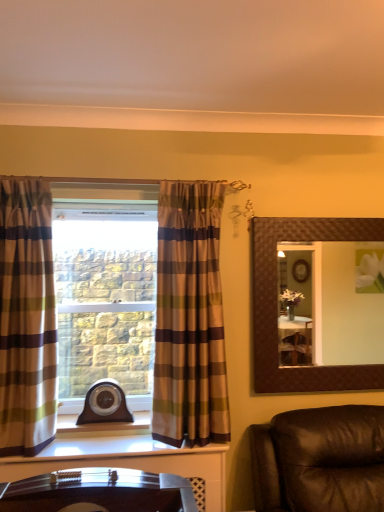
Question: Is brown textured mirror at upper right outside of plaid fabric curtain at left, the 2th curtain positioned from the right?

Choices:
 (A) yes
 (B) no

Answer: (A)

Question: Does brown textured mirror at upper right lie in front of plaid fabric curtain at left, the 2th curtain positioned from the right?

Choices:
 (A) no
 (B) yes

Answer: (A)

Question: Is brown textured mirror at upper right beside plaid fabric curtain at left, the first curtain from the left?

Choices:
 (A) yes
 (B) no

Answer: (B)

Question: Does brown textured mirror at upper right have a greater height compared to plaid fabric curtain at left, the first curtain from the left?

Choices:
 (A) no
 (B) yes

Answer: (A)

Question: Does brown textured mirror at upper right appear on the left side of plaid fabric curtain at left, the 2th curtain positioned from the right?

Choices:
 (A) no
 (B) yes

Answer: (A)

Question: Are brown textured mirror at upper right and plaid fabric curtain at left, the first curtain from the left, far apart?

Choices:
 (A) no
 (B) yes

Answer: (B)

Question: Is brown textured mirror at upper right a part of plaid fabric curtain at left, the 2th curtain positioned from the right?

Choices:
 (A) no
 (B) yes

Answer: (A)

Question: From the image's perspective, would you say plaid fabric curtain at left, the first curtain from the left, is shown under brown textured mirror at upper right?

Choices:
 (A) yes
 (B) no

Answer: (B)

Question: Does plaid fabric curtain at left, the 2th curtain positioned from the right, have a lesser height compared to brown textured mirror at upper right?

Choices:
 (A) yes
 (B) no

Answer: (B)

Question: Is plaid fabric curtain at left, the 2th curtain positioned from the right, wider than brown textured mirror at upper right?

Choices:
 (A) yes
 (B) no

Answer: (A)

Question: From a real-world perspective, is plaid fabric curtain at left, the first curtain from the left, located higher than brown textured mirror at upper right?

Choices:
 (A) yes
 (B) no

Answer: (A)

Question: Considering the relative positions of plaid fabric curtain at left, the 2th curtain positioned from the right, and brown textured mirror at upper right in the image provided, is plaid fabric curtain at left, the 2th curtain positioned from the right, behind brown textured mirror at upper right?

Choices:
 (A) yes
 (B) no

Answer: (B)

Question: Is plaid fabric curtain at left, positioned as the 1th curtain in right-to-left order, positioned with its back to brown textured mirror at upper right?

Choices:
 (A) no
 (B) yes

Answer: (A)